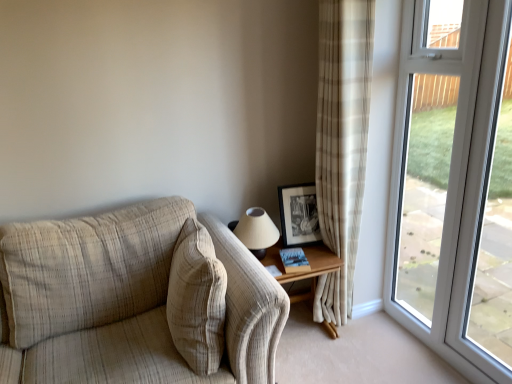
Question: Considering the positions of point (335, 258) and point (434, 96), is point (335, 258) closer or farther from the camera than point (434, 96)?

Choices:
 (A) closer
 (B) farther

Answer: (B)

Question: From their relative heights in the image, would you say wooden table at right is taller or shorter than transparent glass screen door at right?

Choices:
 (A) short
 (B) tall

Answer: (A)

Question: Considering the real-world distances, which object is farthest from the beige plaid curtain at right?

Choices:
 (A) transparent glass window at right
 (B) transparent glass screen door at right
 (C) transparent glass window at right
 (D) hardcover book at lower right
 (E) beige textured pillow at center

Answer: (A)

Question: Which object is positioned closest to the transparent glass screen door at right?

Choices:
 (A) hardcover book at lower right
 (B) wooden table at right
 (C) beige plaid curtain at right
 (D) transparent glass window at right
 (E) beige textured pillow at center

Answer: (D)